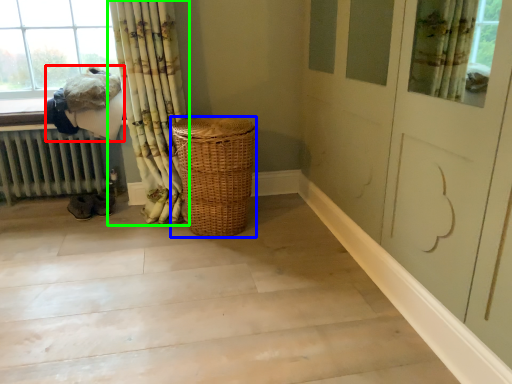
Question: Which is nearer to the laundry (highlighted by a red box)? basket (highlighted by a blue box) or curtain (highlighted by a green box).

Choices:
 (A) basket
 (B) curtain

Answer: (B)